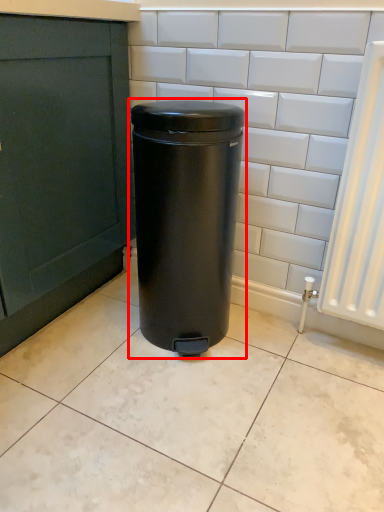
Question: From the image's perspective, where is waste container (annotated by the red box) located relative to ceramic tile?

Choices:
 (A) below
 (B) above

Answer: (B)